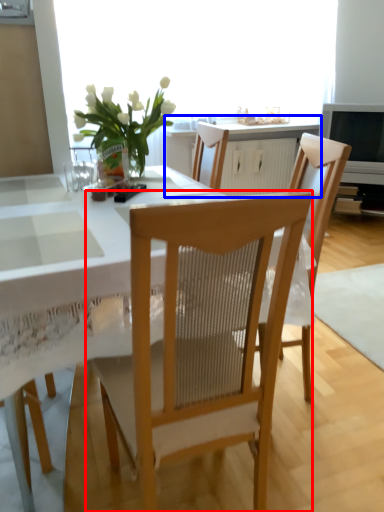
Question: Which of the following is the closest to the observer, chair (highlighted by a red box) or cabinetry (highlighted by a blue box)?

Choices:
 (A) chair
 (B) cabinetry

Answer: (A)